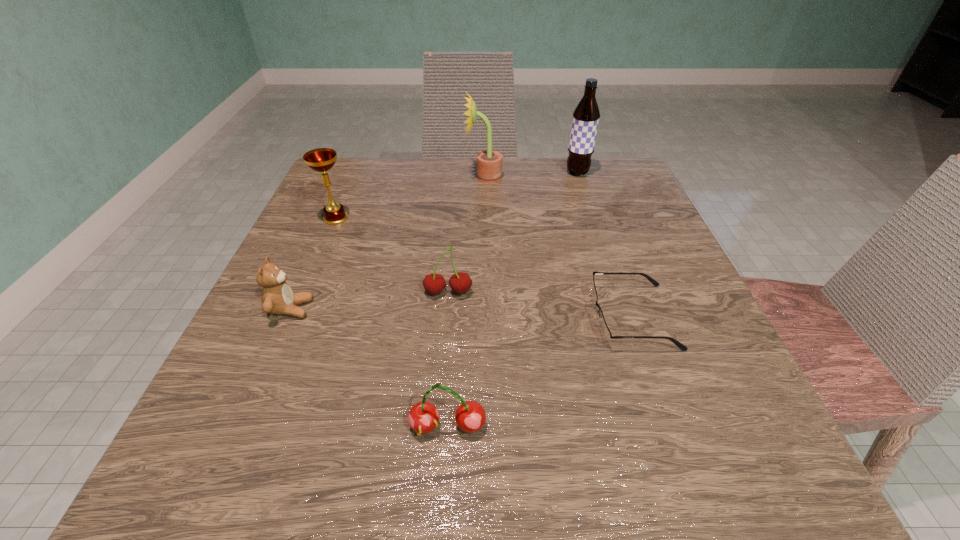
The width and height of the screenshot is (960, 540). In the image, there is a desktop. Find the location of `vacant space at the right edge`. vacant space at the right edge is located at coordinates (661, 232).

You are a GUI agent. You are given a task and a screenshot of the screen. Output one action in this format:
    pyautogui.click(x=<x>, y=<y>)
    Task: Click on the free space at the far left corner of the desktop
    This screenshot has width=960, height=540.
    Given the screenshot: What is the action you would take?
    pyautogui.click(x=372, y=166)

The width and height of the screenshot is (960, 540). Identify the location of free spot at the far right corner of the desktop. (600, 191).

In the image, there is a desktop. Identify the location of vacant space at the near right corner. (671, 434).

This screenshot has width=960, height=540. Identify the location of vacant area between the farther cherry and the root beer. (513, 233).

At what (x,y) coordinates should I click in order to perform the action: click on unoccupied area between the teddy bear and the third tallest object. Please return your answer as a coordinate pair (x, y). The height and width of the screenshot is (540, 960). Looking at the image, I should click on (314, 264).

In order to click on vacant space in between the nearer cherry and the farther cherry in this screenshot , I will do `click(447, 360)`.

This screenshot has width=960, height=540. What are the coordinates of `free space between the root beer and the sunflower` in the screenshot? It's located at (531, 175).

Locate an element on the screen. empty space between the shortest object and the teddy bear is located at coordinates (462, 313).

At what (x,y) coordinates should I click in order to perform the action: click on unoccupied area between the teddy bear and the farther cherry. Please return your answer as a coordinate pair (x, y). Looking at the image, I should click on (370, 301).